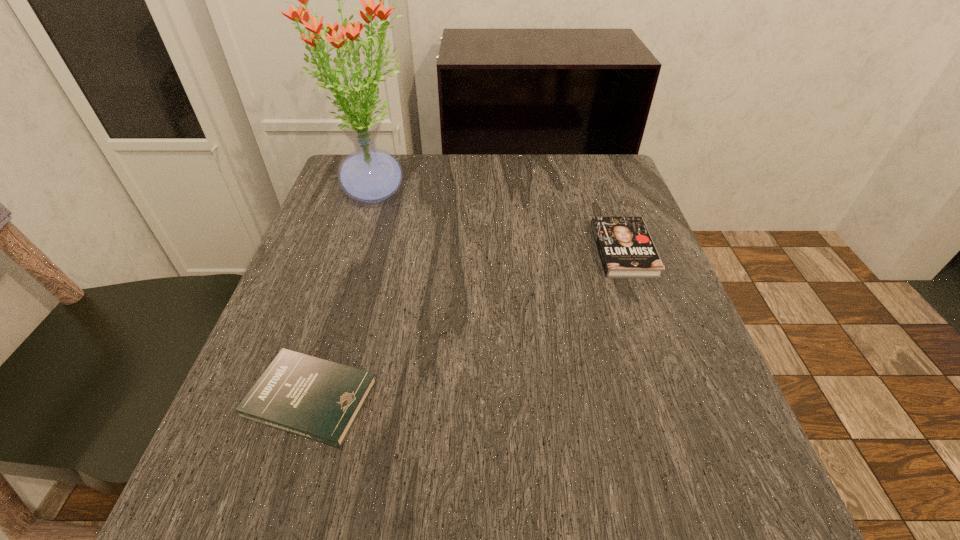
In order to click on object that is the second nearest to the left book in this screenshot , I will do `click(626, 250)`.

In order to click on object that stands as the second closest to the nearest object in this screenshot , I will do `click(626, 250)`.

Locate an element on the screen. This screenshot has height=540, width=960. free space that satisfies the following two spatial constraints: 1. on the front side of the tallest object; 2. on the right side of the right book is located at coordinates (356, 250).

This screenshot has width=960, height=540. In order to click on free space in the image that satisfies the following two spatial constraints: 1. on the back side of the nearest object; 2. on the right side of the rightmost object in this screenshot , I will do `click(357, 250)`.

The width and height of the screenshot is (960, 540). I want to click on free spot that satisfies the following two spatial constraints: 1. on the front side of the tallest object; 2. on the left side of the left book, so click(310, 399).